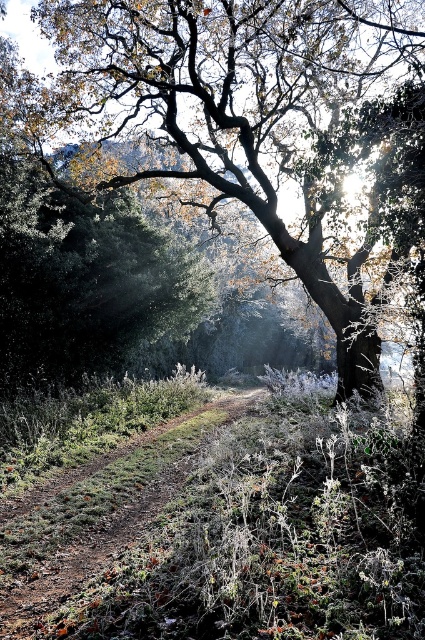
You are standing in the scene and want to walk from the point at coordinates point (266, 184) to the point at coordinates point (31, 611). Which direction should you move relative to your current position?

Since point (266, 184) is further to the viewer than point (31, 611), you should move forward towards the point (31, 611) to reach it.

You are a hiker who wants to take a photo of the smooth brown tree trunk at center and the brown dirt path at center. Which object is wider?

The smooth brown tree trunk at center is wider than the brown dirt path at center.

You are standing in the scene and want to pick up a leaf that is exactly at the point specified by point (354, 161). Considering your reach is 30 feet, can you reach it without moving?

The point (354, 161) is 29.08 feet away from the viewer. Since your reach is 30 feet, you can reach it without moving.